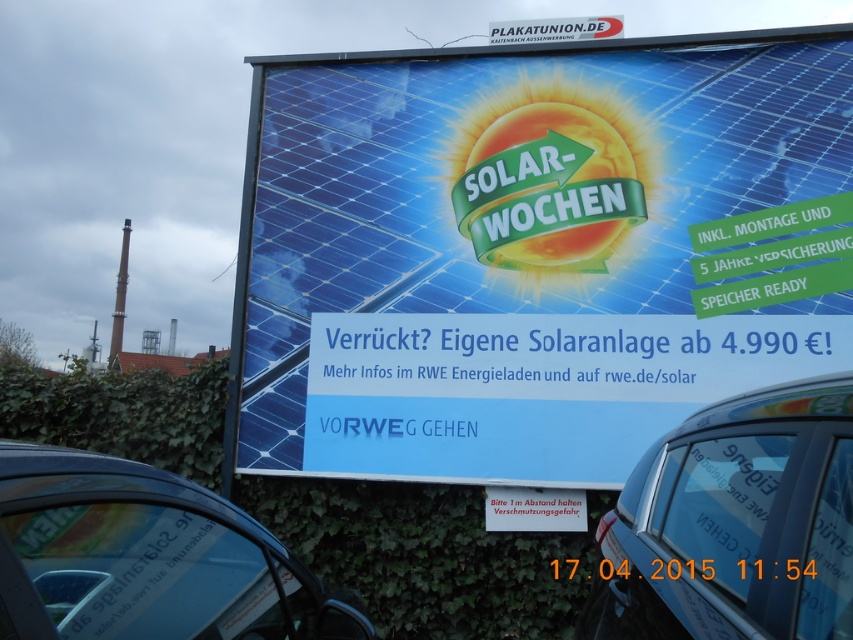
Between blue solar panel at center and white plastic sign at lower center, which one has less height?

white plastic sign at lower center is shorter.

Between blue solar panel at center and white plastic sign at lower center, which one appears on the left side from the viewer's perspective?

From the viewer's perspective, white plastic sign at lower center appears more on the left side.

At what (x,y) coordinates should I click in order to perform the action: click on blue solar panel at center. Please return your answer as a coordinate pair (x, y). Looking at the image, I should click on (535, 250).

Is blue solar panel at center positioned in front of metallic silver car at lower left?

No, it is behind metallic silver car at lower left.

Does point (402, 289) come closer to viewer compared to point (225, 618)?

That is False.

Measure the distance between point (811, 225) and camera.

The distance of point (811, 225) from camera is 12.89 feet.

The height and width of the screenshot is (640, 853). I want to click on blue solar panel at center, so click(x=535, y=250).

Does metallic silver car at lower left appear on the left side of white plastic sign at lower center?

Correct, you'll find metallic silver car at lower left to the left of white plastic sign at lower center.

Who is more forward, (267, 595) or (496, 513)?

Point (267, 595)

Where is `metallic silver car at lower left`? This screenshot has width=853, height=640. metallic silver car at lower left is located at coordinates (144, 557).